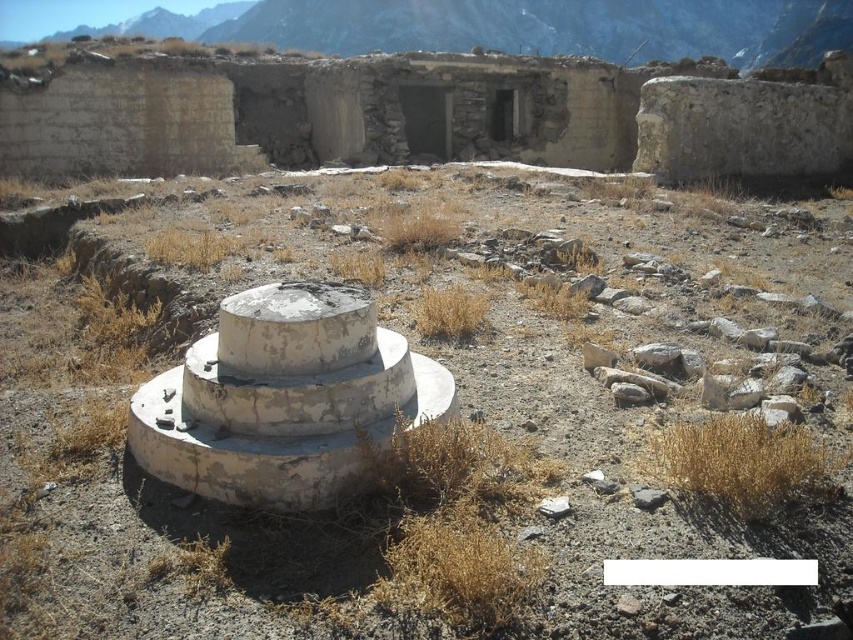
Question: Does white weathered concrete structure at center appear on the left side of gray stone mountain at upper center?

Choices:
 (A) no
 (B) yes

Answer: (A)

Question: Can you confirm if gray stone mountain at upper center is wider than weathered concrete cylinder at center?

Choices:
 (A) yes
 (B) no

Answer: (A)

Question: Which of the following is the closest to the observer?

Choices:
 (A) (233, 330)
 (B) (196, 29)
 (C) (146, 442)
 (D) (251, 83)

Answer: (C)

Question: Is the position of weathered concrete ruins at upper center less distant than that of gray stone mountain at upper center?

Choices:
 (A) yes
 (B) no

Answer: (A)

Question: Which point appears closest to the camera in this image?

Choices:
 (A) (386, 49)
 (B) (287, 324)

Answer: (B)

Question: Considering the real-world distances, which object is closest to the weathered concrete ruins at upper center?

Choices:
 (A) weathered concrete cylinder at center
 (B) white weathered concrete structure at center
 (C) gray stone mountain at upper center

Answer: (B)